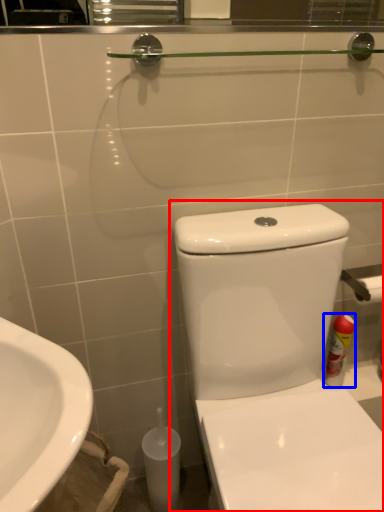
Question: Among these objects, which one is nearest to the camera, toilet (highlighted by a red box) or cleaning product (highlighted by a blue box)?

Choices:
 (A) toilet
 (B) cleaning product

Answer: (A)